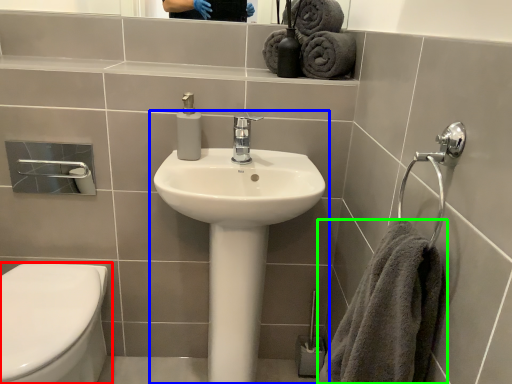
Question: Based on their relative distances, which object is nearer to toilet (highlighted by a red box)? Choose from sink (highlighted by a blue box) and towel (highlighted by a green box).

Choices:
 (A) sink
 (B) towel

Answer: (A)